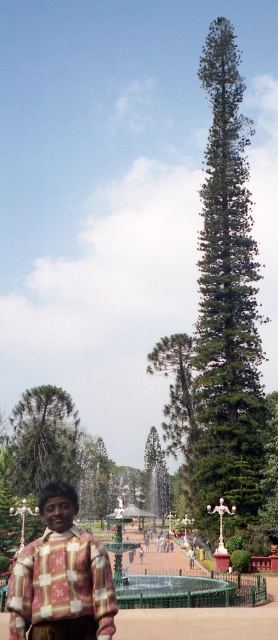
From the picture: Is green textured pine tree at center below plaid fabric shirt at lower left?

Incorrect, green textured pine tree at center is not positioned below plaid fabric shirt at lower left.

Between green textured pine tree at center and plaid fabric shirt at lower left, which one is positioned lower?

Positioned lower is plaid fabric shirt at lower left.

Measure the distance between green textured pine tree at center and camera.

green textured pine tree at center and camera are 55.55 meters apart.

Identify the location of green textured pine tree at center. This screenshot has height=640, width=278. (226, 307).

Is plaid fabric shirt at lower left thinner than green matte tree at center?

Yes, plaid fabric shirt at lower left is thinner than green matte tree at center.

Looking at this image, who is higher up, plaid fabric shirt at lower left or green matte tree at center?

Positioned higher is plaid fabric shirt at lower left.

This screenshot has height=640, width=278. I want to click on plaid fabric shirt at lower left, so [x=61, y=577].

Where is `plaid fabric shirt at lower left`? plaid fabric shirt at lower left is located at coordinates (61, 577).

Which is behind, point (234, 225) or point (48, 396)?

The point (48, 396) is behind.

The height and width of the screenshot is (640, 278). What are the coordinates of `green textured pine tree at center` in the screenshot? It's located at (226, 307).